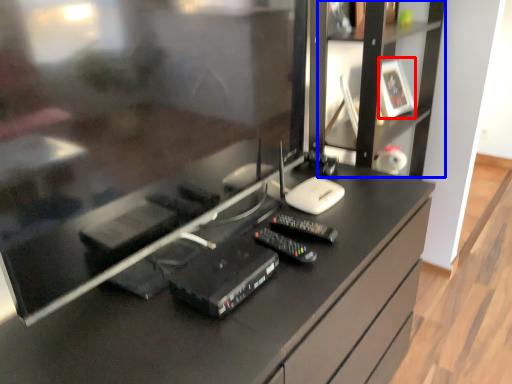
Question: Which object is closer to the camera taking this photo, picture frame (highlighted by a red box) or tv cabinet (highlighted by a blue box)?

Choices:
 (A) picture frame
 (B) tv cabinet

Answer: (B)